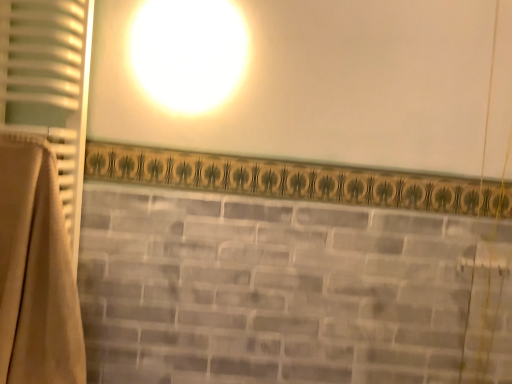
Identify the location of beige fabric curtain at left, the 2th curtain when ordered from bottom to top. The height and width of the screenshot is (384, 512). (50, 84).

What do you see at coordinates (50, 84) in the screenshot? This screenshot has height=384, width=512. I see `beige fabric curtain at left, which appears as the first curtain when viewed from the top` at bounding box center [50, 84].

Identify the location of beige fabric curtain at left, which appears as the 2th curtain when viewed from the top. (36, 271).

What do you see at coordinates (36, 271) in the screenshot? The height and width of the screenshot is (384, 512). I see `beige fabric curtain at left, which is the first curtain from bottom to top` at bounding box center [36, 271].

At what (x,y) coordinates should I click in order to perform the action: click on beige fabric curtain at left, which appears as the first curtain when viewed from the top. Please return your answer as a coordinate pair (x, y). This screenshot has height=384, width=512. Looking at the image, I should click on (50, 84).

Considering the relative positions of beige fabric curtain at left, which is the first curtain from bottom to top, and beige fabric curtain at left, which appears as the first curtain when viewed from the top, in the image provided, is beige fabric curtain at left, which is the first curtain from bottom to top, to the right of beige fabric curtain at left, which appears as the first curtain when viewed from the top, from the viewer's perspective?

Yes.

Who is more distant, beige fabric curtain at left, which is the first curtain from bottom to top, or beige fabric curtain at left, the 2th curtain when ordered from bottom to top?

beige fabric curtain at left, the 2th curtain when ordered from bottom to top, is more distant.

Is point (46, 224) closer or farther from the camera than point (13, 55)?

Point (46, 224) is positioned closer to the camera compared to point (13, 55).

From the image's perspective, is beige fabric curtain at left, which appears as the 2th curtain when viewed from the top, above beige fabric curtain at left, which appears as the first curtain when viewed from the top?

No, from the image's perspective, beige fabric curtain at left, which appears as the 2th curtain when viewed from the top, is not over beige fabric curtain at left, which appears as the first curtain when viewed from the top.

From a real-world perspective, is beige fabric curtain at left, which is the first curtain from bottom to top, physically above beige fabric curtain at left, the 2th curtain when ordered from bottom to top?

Actually, beige fabric curtain at left, which is the first curtain from bottom to top, is physically below beige fabric curtain at left, the 2th curtain when ordered from bottom to top, in the real world.

Is beige fabric curtain at left, which is the first curtain from bottom to top, wider or thinner than beige fabric curtain at left, the 2th curtain when ordered from bottom to top?

beige fabric curtain at left, which is the first curtain from bottom to top, is wider than beige fabric curtain at left, the 2th curtain when ordered from bottom to top.

Based on the photo, from their relative heights in the image, would you say beige fabric curtain at left, which appears as the 2th curtain when viewed from the top, is taller or shorter than beige fabric curtain at left, which appears as the first curtain when viewed from the top?

In the image, beige fabric curtain at left, which appears as the 2th curtain when viewed from the top, appears to be taller than beige fabric curtain at left, which appears as the first curtain when viewed from the top.

Considering the sizes of objects beige fabric curtain at left, which is the first curtain from bottom to top, and beige fabric curtain at left, the 2th curtain when ordered from bottom to top, in the image provided, who is bigger, beige fabric curtain at left, which is the first curtain from bottom to top, or beige fabric curtain at left, the 2th curtain when ordered from bottom to top,?

With larger size is beige fabric curtain at left, which is the first curtain from bottom to top.

Is beige fabric curtain at left, which is the first curtain from bottom to top, not inside beige fabric curtain at left, which appears as the first curtain when viewed from the top?

That's correct, beige fabric curtain at left, which is the first curtain from bottom to top, is outside of beige fabric curtain at left, which appears as the first curtain when viewed from the top.

Are beige fabric curtain at left, which appears as the 2th curtain when viewed from the top, and beige fabric curtain at left, which appears as the first curtain when viewed from the top, located far from each other?

No.

Is beige fabric curtain at left, which appears as the first curtain when viewed from the top, at the back of beige fabric curtain at left, which appears as the 2th curtain when viewed from the top?

That's not correct — beige fabric curtain at left, which appears as the 2th curtain when viewed from the top, is not looking away from beige fabric curtain at left, which appears as the first curtain when viewed from the top.

What's the angular difference between beige fabric curtain at left, which appears as the 2th curtain when viewed from the top, and beige fabric curtain at left, which appears as the first curtain when viewed from the top,'s facing directions?

beige fabric curtain at left, which appears as the 2th curtain when viewed from the top, and beige fabric curtain at left, which appears as the first curtain when viewed from the top, are facing 0.000178 degrees away from each other.

At what (x,y) coordinates should I click in order to perform the action: click on curtain that appears on the right of beige fabric curtain at left, which appears as the first curtain when viewed from the top. Please return your answer as a coordinate pair (x, y). This screenshot has width=512, height=384. Looking at the image, I should click on (36, 271).

Is beige fabric curtain at left, which appears as the first curtain when viewed from the top, to the left of beige fabric curtain at left, which appears as the 2th curtain when viewed from the top, from the viewer's perspective?

Yes, beige fabric curtain at left, which appears as the first curtain when viewed from the top, is to the left of beige fabric curtain at left, which appears as the 2th curtain when viewed from the top.

Is beige fabric curtain at left, which appears as the first curtain when viewed from the top, in front of beige fabric curtain at left, which is the first curtain from bottom to top?

No, the depth of beige fabric curtain at left, which appears as the first curtain when viewed from the top, is greater than that of beige fabric curtain at left, which is the first curtain from bottom to top.

Is point (75, 45) positioned after point (11, 155)?

Yes.

From the image's perspective, which one is positioned higher, beige fabric curtain at left, the 2th curtain when ordered from bottom to top, or beige fabric curtain at left, which appears as the 2th curtain when viewed from the top?

From the image's view, beige fabric curtain at left, the 2th curtain when ordered from bottom to top, is above.

From a real-world perspective, is beige fabric curtain at left, which appears as the first curtain when viewed from the top, physically located above or below beige fabric curtain at left, which is the first curtain from bottom to top?

beige fabric curtain at left, which appears as the first curtain when viewed from the top, is above beige fabric curtain at left, which is the first curtain from bottom to top.

Between beige fabric curtain at left, which appears as the first curtain when viewed from the top, and beige fabric curtain at left, which appears as the 2th curtain when viewed from the top, which one has smaller width?

With smaller width is beige fabric curtain at left, which appears as the first curtain when viewed from the top.

Considering the relative sizes of beige fabric curtain at left, which appears as the first curtain when viewed from the top, and beige fabric curtain at left, which appears as the 2th curtain when viewed from the top, in the image provided, is beige fabric curtain at left, which appears as the first curtain when viewed from the top, shorter than beige fabric curtain at left, which appears as the 2th curtain when viewed from the top,?

Yes, beige fabric curtain at left, which appears as the first curtain when viewed from the top, is shorter than beige fabric curtain at left, which appears as the 2th curtain when viewed from the top.

Considering the sizes of objects beige fabric curtain at left, which appears as the first curtain when viewed from the top, and beige fabric curtain at left, which is the first curtain from bottom to top, in the image provided, who is smaller, beige fabric curtain at left, which appears as the first curtain when viewed from the top, or beige fabric curtain at left, which is the first curtain from bottom to top,?

beige fabric curtain at left, which appears as the first curtain when viewed from the top, is smaller.

Could beige fabric curtain at left, which is the first curtain from bottom to top, be considered to be inside beige fabric curtain at left, which appears as the first curtain when viewed from the top?

Actually, beige fabric curtain at left, which is the first curtain from bottom to top, is outside beige fabric curtain at left, which appears as the first curtain when viewed from the top.

Is beige fabric curtain at left, which appears as the first curtain when viewed from the top, beside beige fabric curtain at left, which appears as the 2th curtain when viewed from the top?

They are not placed beside each other.

Is beige fabric curtain at left, the 2th curtain when ordered from bottom to top, oriented away from beige fabric curtain at left, which is the first curtain from bottom to top?

No, beige fabric curtain at left, which is the first curtain from bottom to top, is not at the back of beige fabric curtain at left, the 2th curtain when ordered from bottom to top.

What's the angular difference between beige fabric curtain at left, which appears as the first curtain when viewed from the top, and beige fabric curtain at left, which appears as the 2th curtain when viewed from the top,'s facing directions?

They differ by 0.000178 degrees in their facing directions.

Measure the distance between beige fabric curtain at left, which appears as the first curtain when viewed from the top, and beige fabric curtain at left, which is the first curtain from bottom to top.

beige fabric curtain at left, which appears as the first curtain when viewed from the top, and beige fabric curtain at left, which is the first curtain from bottom to top, are 7.80 inches apart from each other.

You are a GUI agent. You are given a task and a screenshot of the screen. Output one action in this format:
    pyautogui.click(x=<x>, y=<y>)
    Task: Click on the curtain behind the beige fabric curtain at left, which appears as the 2th curtain when viewed from the top
    
    Given the screenshot: What is the action you would take?
    pyautogui.click(x=50, y=84)

I want to click on curtain on the left of beige fabric curtain at left, which is the first curtain from bottom to top, so click(50, 84).

The image size is (512, 384). Identify the location of curtain in front of the beige fabric curtain at left, which appears as the first curtain when viewed from the top. (36, 271).